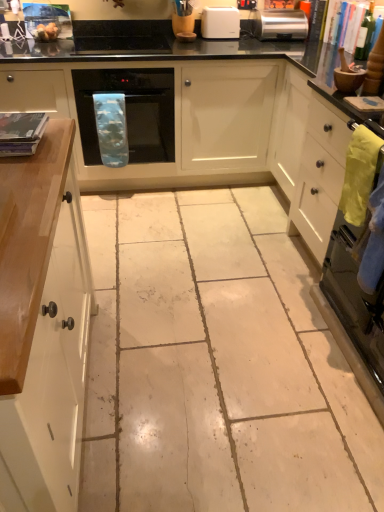
Question: Looking at their shapes, would you say green glass bottle at upper right is wider or thinner than white plastic toaster at upper center?

Choices:
 (A) thin
 (B) wide

Answer: (A)

Question: Would you say green glass bottle at upper right is inside or outside white plastic toaster at upper center?

Choices:
 (A) inside
 (B) outside

Answer: (B)

Question: Estimate the real-world distances between objects in this image. Which object is farther from the black glass oven at center?

Choices:
 (A) black glossy countertop at upper center
 (B) green glass bottle at upper right
 (C) black glass cooktop at upper center
 (D) stainless steel oven at right
 (E) white glossy cabinet at left

Answer: (D)

Question: Which object is the closest to the black glass cooktop at upper center?

Choices:
 (A) white plastic toaster at upper center
 (B) white glossy cabinet at left
 (C) green glass bottle at upper right
 (D) black glossy countertop at upper center
 (E) satin silver toaster at upper right

Answer: (D)